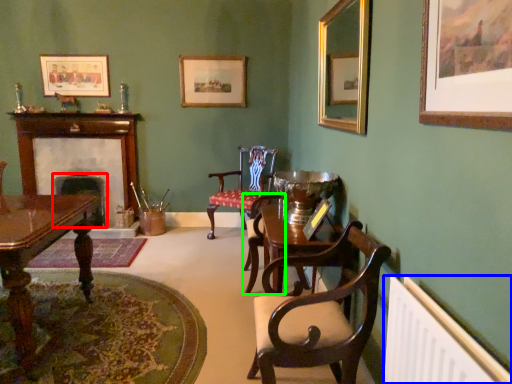
Question: Which is farther away from fireplace (highlighted by a red box)? radiator (highlighted by a blue box) or armchair (highlighted by a green box)?

Choices:
 (A) radiator
 (B) armchair

Answer: (A)